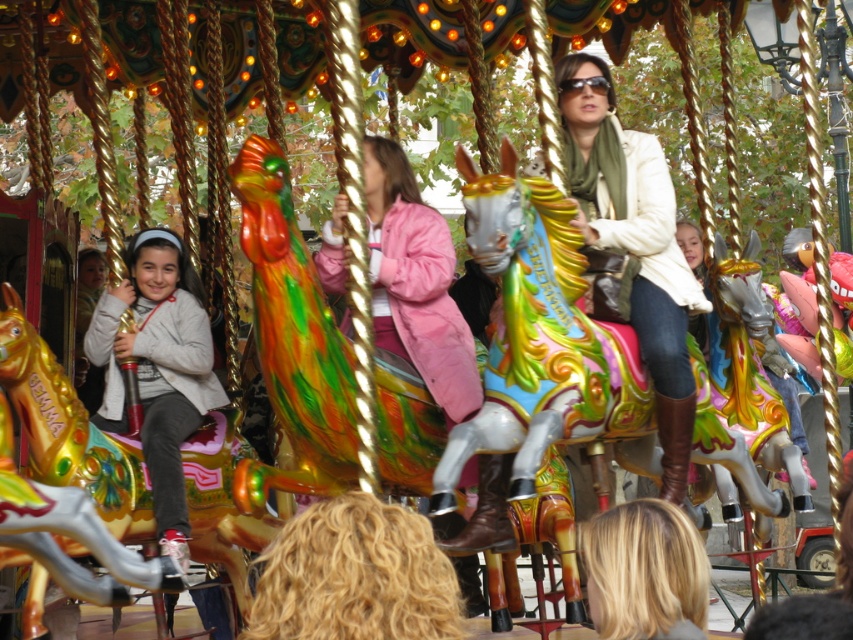
Question: Which is nearer to the shiny gold horse at left?

Choices:
 (A) matte gray jacket at left
 (B) matte white jacket at center
 (C) shiny metallic horse at center

Answer: (A)

Question: Can you confirm if matte white jacket at center is thinner than matte gray jacket at left?

Choices:
 (A) yes
 (B) no

Answer: (B)

Question: Among these points, which one is farthest from the camera?

Choices:
 (A) (112, 419)
 (B) (26, 440)
 (C) (665, 314)

Answer: (A)

Question: Does shiny metallic horse at center come behind matte gray jacket at left?

Choices:
 (A) yes
 (B) no

Answer: (B)

Question: Does shiny metallic horse at center appear on the right side of matte white jacket at center?

Choices:
 (A) no
 (B) yes

Answer: (A)

Question: Which of the following is the closest to the observer?

Choices:
 (A) (515, 397)
 (B) (582, 180)
 (C) (151, 253)

Answer: (A)